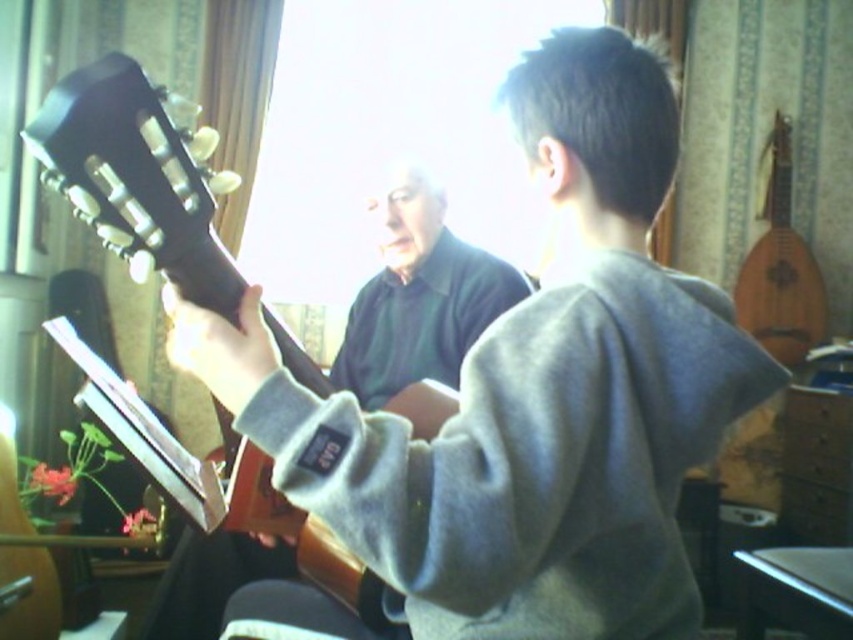
You are a photographer setting up a shoot in this scene. You need to place a light source so that it illuminates both the gray fleece sweater at center and the dark brown wood guitar at left. Based on their positions, where should you place the light source relative to the guitar?

The gray fleece sweater at center is below the dark brown wood guitar at left, so placing the light source above the guitar would cast light downward, illuminating both the guitar and the sweater below it.

You are a photographer setting up a shoot in the scene. You need to place a microphone exactly between the gray fleece sweater at center and the dark brown wood guitar at left. Which object should the microphone be closer to?

The microphone should be closer to the dark brown wood guitar at left because the gray fleece sweater at center is to the right of the dark brown wood guitar at left, meaning the guitar is on the left side and the sweater is positioned to its right. Since the microphone is placed exactly between them, it would be closer to the guitar as the distance from the center to the guitar is less than from the guitar to the sweater.

You are standing in the room and want to place a small plant between the two points, point (238, 360) and point (119, 67). Which point should the plant be closer to in order to be nearer to the person playing the guitar?

Result: The plant should be closer to point (238, 360) because it is closer to the viewer than point (119, 67), and the person playing the guitar is in the foreground.